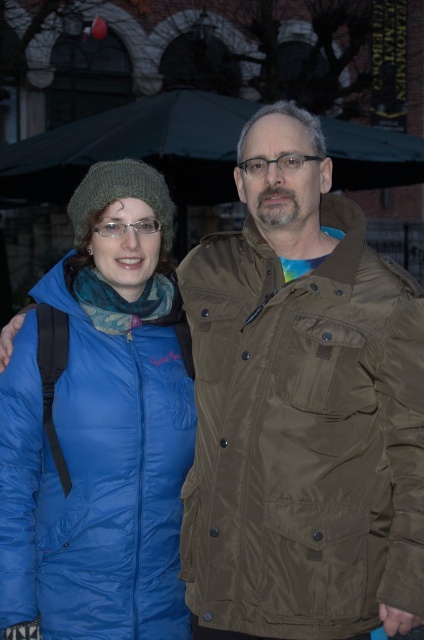
Looking at this image, you are standing in the public space shown in the image and want to place a small decorative item between the two points, point (242, 422) and point (119, 368). Which point should the item be closer to in order to be nearer to the viewer?

The item should be closer to point (242, 422) because it is nearer to the viewer than point (119, 368).

You are a photographer trying to capture a photo of the olive green fabric jacket at right. The camera you are using has a very narrow field of view that only captures objects within a 0.5 unit radius centered at the point you select. To ensure the jacket is in the photo, which point should you aim the camera at to center it?

You should aim the camera at the point closest to the olive green fabric jacket at right, which is at location (303, 435). This will center the jacket within the camera view since the jacket is located at that coordinate.

You are a photographer trying to capture a group photo of two people wearing jackets. You need to ensure there is enough space between them for a natural pose. The minimum required distance for your shot is 2 meters. Based on the scene described, can you confirm if the distance between the olive green fabric jacket at right and the matte blue puffer jacket at center meets this requirement?

The olive green fabric jacket at right and the matte blue puffer jacket at center are 2.66 meters apart from each other, which exceeds the minimum required distance of 2 meters. Therefore, the distance between them is sufficient for your natural pose requirement.